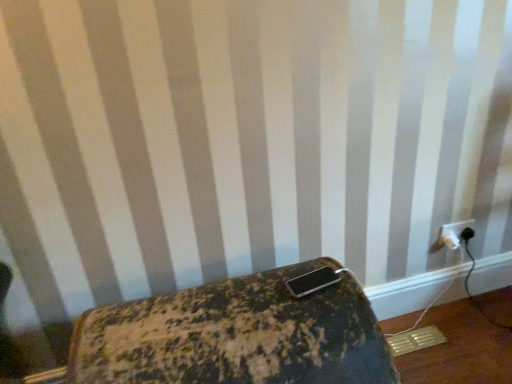
Question: Considering their positions, is white plastic power plugs and sockets at lower right located in front of or behind rusty metal suitcase at lower center?

Choices:
 (A) behind
 (B) front

Answer: (A)

Question: From a real-world perspective, is white plastic power plugs and sockets at lower right positioned above or below rusty metal suitcase at lower center?

Choices:
 (A) above
 (B) below

Answer: (A)

Question: Is white plastic power plugs and sockets at lower right wider or thinner than rusty metal suitcase at lower center?

Choices:
 (A) wide
 (B) thin

Answer: (B)

Question: Looking at their shapes, would you say rusty metal suitcase at lower center is wider or thinner than white plastic power plugs and sockets at lower right?

Choices:
 (A) wide
 (B) thin

Answer: (A)

Question: Is point pos(300,271) closer or farther from the camera than point pos(439,236)?

Choices:
 (A) farther
 (B) closer

Answer: (B)

Question: Is rusty metal suitcase at lower center spatially inside white plastic power plugs and sockets at lower right, or outside of it?

Choices:
 (A) outside
 (B) inside

Answer: (A)

Question: In the image, is rusty metal suitcase at lower center on the left side or the right side of white plastic power plugs and sockets at lower right?

Choices:
 (A) right
 (B) left

Answer: (B)